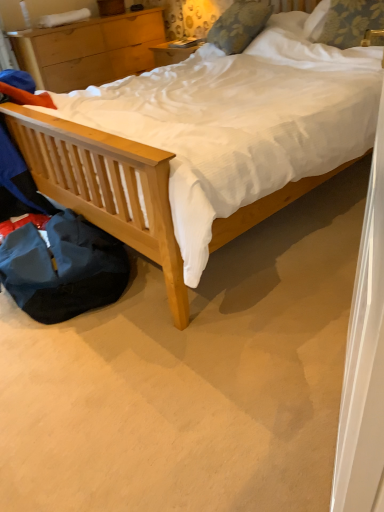
The height and width of the screenshot is (512, 384). In order to click on light wood nightstand at upper left in this screenshot , I will do `click(89, 50)`.

The width and height of the screenshot is (384, 512). Describe the element at coordinates (344, 21) in the screenshot. I see `floral fabric pillow at upper right, arranged as the 2th pillow when viewed from the left` at that location.

Identify the location of floral fabric pillow at upper center, the second pillow when ordered from right to left. The width and height of the screenshot is (384, 512). (239, 25).

What's the angular difference between light wood nightstand at upper left and floral fabric pillow at upper right, positioned as the first pillow in right-to-left order,'s facing directions?

There is a 77.6-degree angle between the facing directions of light wood nightstand at upper left and floral fabric pillow at upper right, positioned as the first pillow in right-to-left order.

Is light wood nightstand at upper left positioned before floral fabric pillow at upper right, arranged as the 2th pillow when viewed from the left?

No, light wood nightstand at upper left is further to the viewer.

Does light wood nightstand at upper left have a smaller size compared to floral fabric pillow at upper right, arranged as the 2th pillow when viewed from the left?

No, light wood nightstand at upper left is not smaller than floral fabric pillow at upper right, arranged as the 2th pillow when viewed from the left.

Which is closer to the camera, (75,82) or (336,46)?

The point (336,46) is in front.

Measure the distance from light wood nightstand at upper left to floral fabric pillow at upper center, the second pillow when ordered from right to left.

light wood nightstand at upper left and floral fabric pillow at upper center, the second pillow when ordered from right to left, are 4.38 feet apart from each other.

Is light wood nightstand at upper left taller than floral fabric pillow at upper center, the second pillow when ordered from right to left?

Correct, light wood nightstand at upper left is much taller as floral fabric pillow at upper center, the second pillow when ordered from right to left.

Does light wood nightstand at upper left have a smaller size compared to floral fabric pillow at upper center, marked as the first pillow in a left-to-right arrangement?

Actually, light wood nightstand at upper left might be larger than floral fabric pillow at upper center, marked as the first pillow in a left-to-right arrangement.

How different are the orientations of light wood nightstand at upper left and floral fabric pillow at upper center, the second pillow when ordered from right to left, in degrees?

They differ by 99.2 degrees in their facing directions.

From the image's perspective, is floral fabric pillow at upper right, arranged as the 2th pillow when viewed from the left, beneath light wood nightstand at upper left?

Indeed, from the image's perspective, floral fabric pillow at upper right, arranged as the 2th pillow when viewed from the left, is shown beneath light wood nightstand at upper left.

Between point (317, 27) and point (39, 51), which one is positioned in front?

The point (317, 27) is closer to the camera.

Where is `the 2nd pillow below when counting from the light wood nightstand at upper left (from the image's perspective)`? This screenshot has height=512, width=384. the 2nd pillow below when counting from the light wood nightstand at upper left (from the image's perspective) is located at coordinates (344, 21).

Which object is further away from the camera taking this photo, floral fabric pillow at upper right, positioned as the first pillow in right-to-left order, or light wood nightstand at upper left?

light wood nightstand at upper left is more distant.

Does floral fabric pillow at upper right, arranged as the 2th pillow when viewed from the left, touch floral fabric pillow at upper center, marked as the first pillow in a left-to-right arrangement?

No.

From a real-world perspective, relative to floral fabric pillow at upper center, marked as the first pillow in a left-to-right arrangement, is floral fabric pillow at upper right, positioned as the first pillow in right-to-left order, vertically above or below?

Clearly, from a real-world perspective, floral fabric pillow at upper right, positioned as the first pillow in right-to-left order, is below floral fabric pillow at upper center, marked as the first pillow in a left-to-right arrangement.

Is point (383, 7) more distant than point (269, 10)?

No, (383, 7) is in front of (269, 10).

Is floral fabric pillow at upper center, marked as the first pillow in a left-to-right arrangement, positioned with its back to light wood nightstand at upper left?

floral fabric pillow at upper center, marked as the first pillow in a left-to-right arrangement, is not turned away from light wood nightstand at upper left.

Which pillow is the 1st one when counting from the front of the light wood nightstand at upper left? Please provide its 2D coordinates.

[(239, 25)]

Considering the sizes of objects floral fabric pillow at upper center, the second pillow when ordered from right to left, and light wood nightstand at upper left in the image provided, who is thinner, floral fabric pillow at upper center, the second pillow when ordered from right to left, or light wood nightstand at upper left?

floral fabric pillow at upper center, the second pillow when ordered from right to left.

Can you confirm if floral fabric pillow at upper center, marked as the first pillow in a left-to-right arrangement, is bigger than floral fabric pillow at upper right, arranged as the 2th pillow when viewed from the left?

Correct, floral fabric pillow at upper center, marked as the first pillow in a left-to-right arrangement, is larger in size than floral fabric pillow at upper right, arranged as the 2th pillow when viewed from the left.

What's the angular difference between floral fabric pillow at upper center, the second pillow when ordered from right to left, and floral fabric pillow at upper right, positioned as the first pillow in right-to-left order,'s facing directions?

The angular difference between floral fabric pillow at upper center, the second pillow when ordered from right to left, and floral fabric pillow at upper right, positioned as the first pillow in right-to-left order, is 21.6 degrees.

From the image's perspective, is floral fabric pillow at upper center, the second pillow when ordered from right to left, under floral fabric pillow at upper right, arranged as the 2th pillow when viewed from the left?

No, from the image's perspective, floral fabric pillow at upper center, the second pillow when ordered from right to left, is not beneath floral fabric pillow at upper right, arranged as the 2th pillow when viewed from the left.

Consider the image. Which object is positioned more to the left, floral fabric pillow at upper center, the second pillow when ordered from right to left, or floral fabric pillow at upper right, positioned as the first pillow in right-to-left order?

floral fabric pillow at upper center, the second pillow when ordered from right to left, is more to the left.

Locate an element on the screen. The image size is (384, 512). nightstand that is behind the floral fabric pillow at upper right, positioned as the first pillow in right-to-left order is located at coordinates pos(89,50).

From a real-world perspective, which pillow is the 2nd one above the light wood nightstand at upper left? Please provide its 2D coordinates.

[(239, 25)]

From the image, which object appears to be nearer to floral fabric pillow at upper center, the second pillow when ordered from right to left, light wood nightstand at upper left or floral fabric pillow at upper right, positioned as the first pillow in right-to-left order?

floral fabric pillow at upper right, positioned as the first pillow in right-to-left order, lies closer to floral fabric pillow at upper center, the second pillow when ordered from right to left, than the other object.

Based on their spatial positions, is light wood nightstand at upper left or floral fabric pillow at upper center, the second pillow when ordered from right to left, further from floral fabric pillow at upper right, arranged as the 2th pillow when viewed from the left?

Based on the image, light wood nightstand at upper left appears to be further to floral fabric pillow at upper right, arranged as the 2th pillow when viewed from the left.

Which object lies nearer to the anchor point floral fabric pillow at upper center, marked as the first pillow in a left-to-right arrangement, floral fabric pillow at upper right, arranged as the 2th pillow when viewed from the left, or light wood nightstand at upper left?

floral fabric pillow at upper right, arranged as the 2th pillow when viewed from the left, lies closer to floral fabric pillow at upper center, marked as the first pillow in a left-to-right arrangement, than the other object.

Consider the image. Considering their positions, is floral fabric pillow at upper center, marked as the first pillow in a left-to-right arrangement, positioned closer to light wood nightstand at upper left than floral fabric pillow at upper right, positioned as the first pillow in right-to-left order?

Among the two, floral fabric pillow at upper center, marked as the first pillow in a left-to-right arrangement, is located nearer to light wood nightstand at upper left.

Which object lies nearer to the anchor point floral fabric pillow at upper right, positioned as the first pillow in right-to-left order, floral fabric pillow at upper center, the second pillow when ordered from right to left, or light wood nightstand at upper left?

The object closer to floral fabric pillow at upper right, positioned as the first pillow in right-to-left order, is floral fabric pillow at upper center, the second pillow when ordered from right to left.

From the image, which object appears to be nearer to light wood nightstand at upper left, floral fabric pillow at upper right, positioned as the first pillow in right-to-left order, or floral fabric pillow at upper center, the second pillow when ordered from right to left?

Based on the image, floral fabric pillow at upper center, the second pillow when ordered from right to left, appears to be nearer to light wood nightstand at upper left.

Find the location of `pillow between light wood nightstand at upper left and floral fabric pillow at upper right, arranged as the 2th pillow when viewed from the left, in the horizontal direction`. pillow between light wood nightstand at upper left and floral fabric pillow at upper right, arranged as the 2th pillow when viewed from the left, in the horizontal direction is located at coordinates (239, 25).